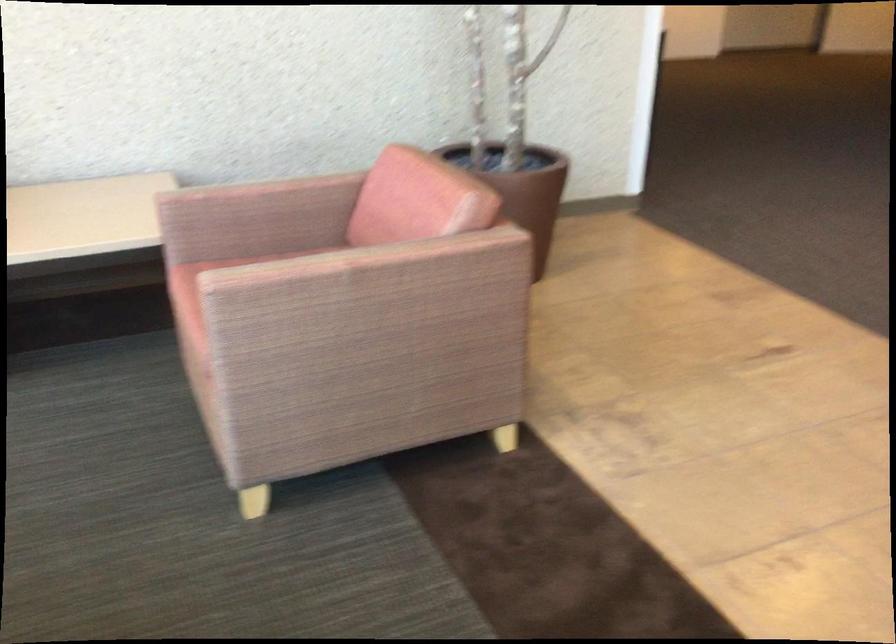
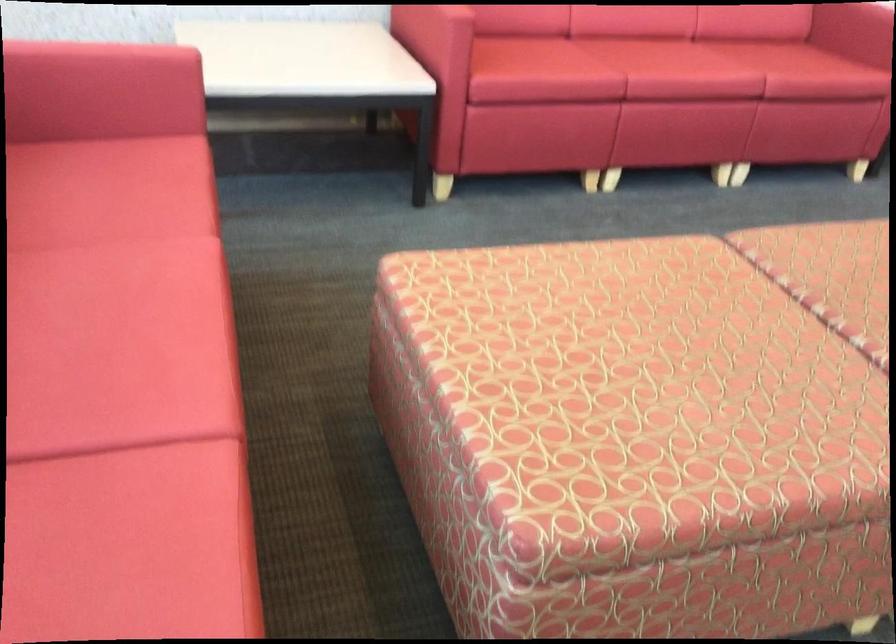
The images are taken continuously from a first-person perspective. In which direction are you moving?

The cameraman walked toward left, backward.